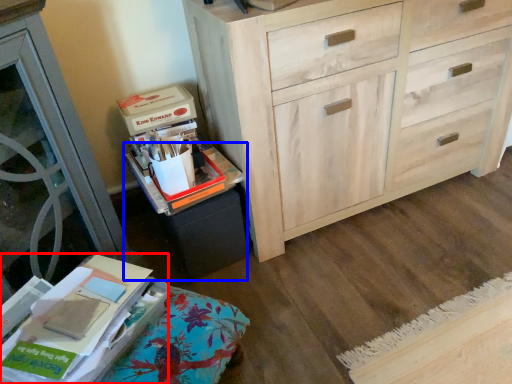
Question: Among these objects, which one is farthest to the camera, paperback book (highlighted by a red box) or cabinetry (highlighted by a blue box)?

Choices:
 (A) paperback book
 (B) cabinetry

Answer: (B)